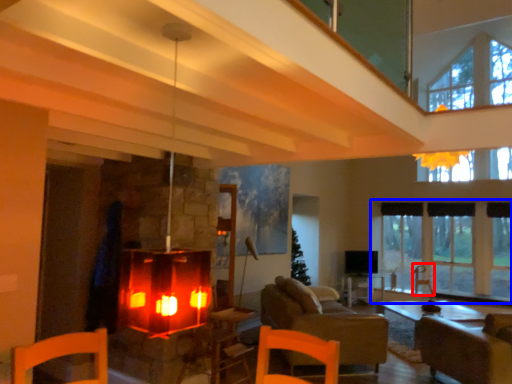
Question: Which object is further to the camera taking this photo, armchair (highlighted by a red box) or window (highlighted by a blue box)?

Choices:
 (A) armchair
 (B) window

Answer: (A)